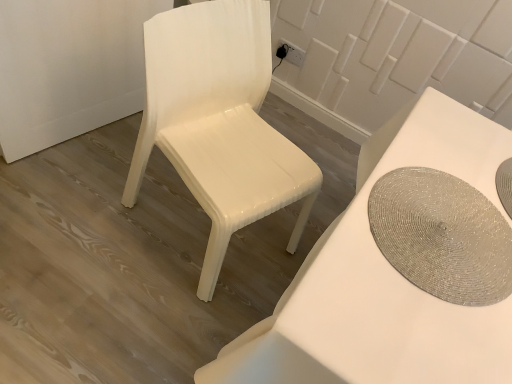
Question: Can you confirm if shiny silver placemat at right is shorter than white glossy chair at left?

Choices:
 (A) yes
 (B) no

Answer: (A)

Question: Can you confirm if shiny silver placemat at right is bigger than white glossy chair at left?

Choices:
 (A) yes
 (B) no

Answer: (B)

Question: Is shiny silver placemat at right facing away from white glossy chair at left?

Choices:
 (A) no
 (B) yes

Answer: (A)

Question: Is shiny silver placemat at right surrounding white glossy chair at left?

Choices:
 (A) no
 (B) yes

Answer: (A)

Question: From a real-world perspective, is shiny silver placemat at right physically above white glossy chair at left?

Choices:
 (A) yes
 (B) no

Answer: (A)

Question: Considering the relative sizes of shiny silver placemat at right and white glossy chair at left in the image provided, is shiny silver placemat at right taller than white glossy chair at left?

Choices:
 (A) yes
 (B) no

Answer: (B)

Question: Does white glossy chair at left have a smaller size compared to shiny silver placemat at right?

Choices:
 (A) no
 (B) yes

Answer: (A)

Question: From the image's perspective, is white glossy chair at left beneath shiny silver placemat at right?

Choices:
 (A) yes
 (B) no

Answer: (B)

Question: Is white glossy chair at left taller than shiny silver placemat at right?

Choices:
 (A) no
 (B) yes

Answer: (B)

Question: Is the depth of white glossy chair at left greater than that of shiny silver placemat at right?

Choices:
 (A) no
 (B) yes

Answer: (B)

Question: From a real-world perspective, is white glossy chair at left positioned under shiny silver placemat at right based on gravity?

Choices:
 (A) yes
 (B) no

Answer: (A)

Question: Does white glossy chair at left have a lesser height compared to shiny silver placemat at right?

Choices:
 (A) yes
 (B) no

Answer: (B)

Question: From the image's perspective, is white glossy table at center located beneath shiny silver placemat at right?

Choices:
 (A) no
 (B) yes

Answer: (B)